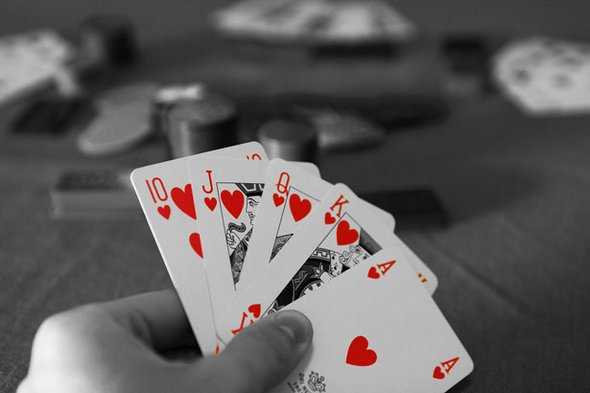
Locate an element on the screen. The width and height of the screenshot is (590, 393). table is located at coordinates (508, 263).